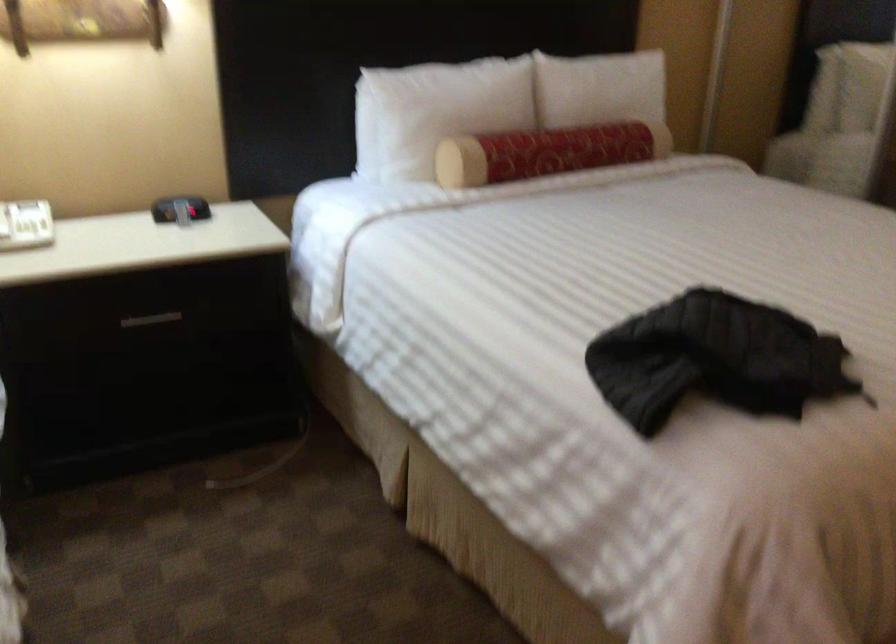
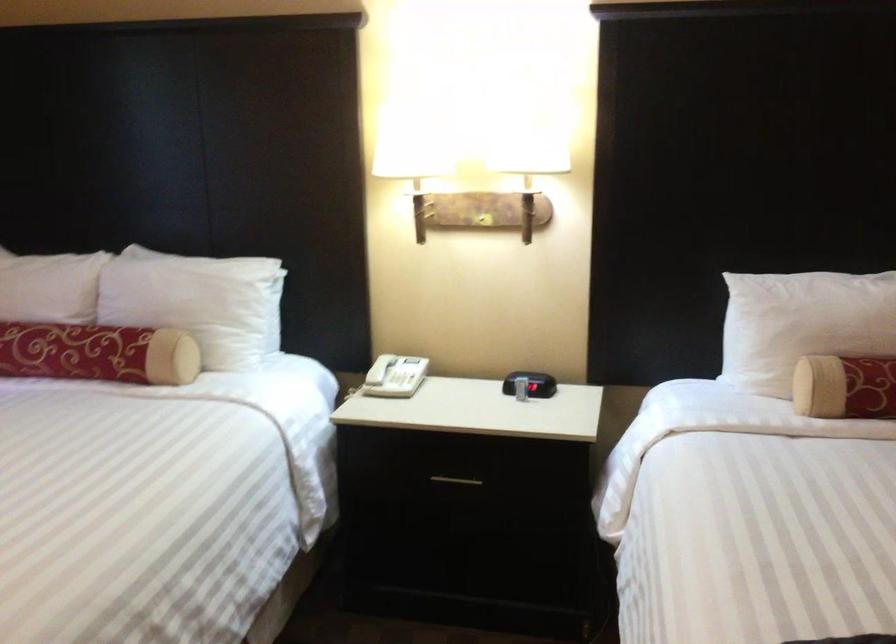
Locate, in the second image, the point that corresponds to (488,162) in the first image.

(845, 386)